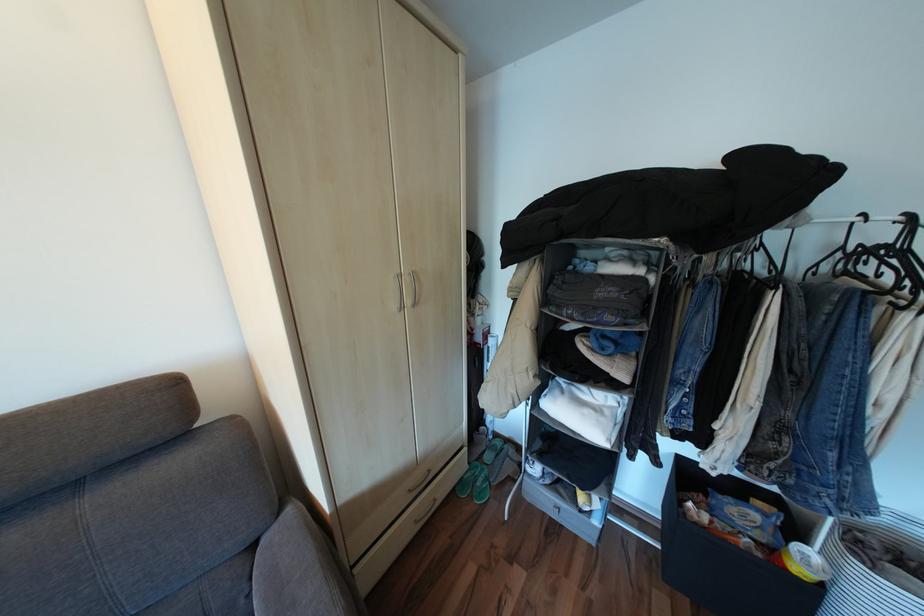
Identify the location of gray sofa armrest. (294, 569).